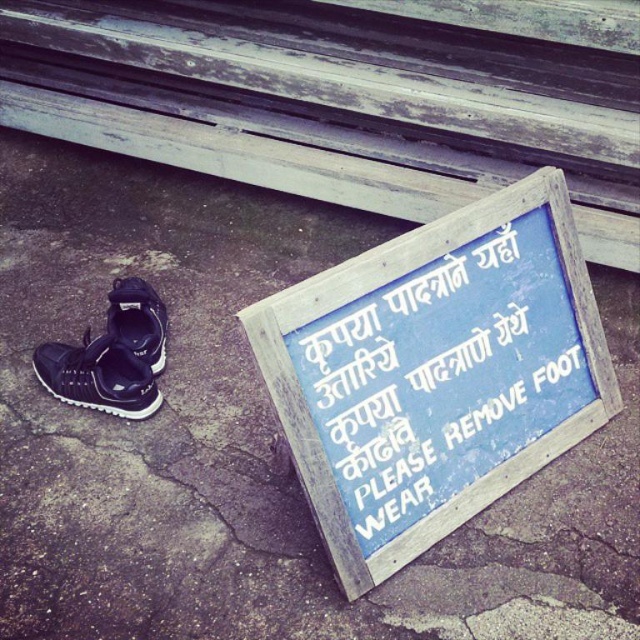
Question: Is blue wooden sign at lower center positioned at the back of black matte shoe at left?

Choices:
 (A) yes
 (B) no

Answer: (B)

Question: Which of the following is the farthest from the observer?

Choices:
 (A) black matte shoe at left
 (B) blue wooden sign at lower center

Answer: (A)

Question: Which point is closer to the camera taking this photo?

Choices:
 (A) (579, 150)
 (B) (49, 365)

Answer: (B)

Question: Which object appears farthest from the camera in this image?

Choices:
 (A) blue wooden sign at lower center
 (B) black matte shoe at left

Answer: (B)

Question: Is blue wooden sign at lower center behind black matte sneaker at lower left?

Choices:
 (A) no
 (B) yes

Answer: (A)

Question: In this image, where is black matte sneaker at lower left located relative to black matte shoe at left?

Choices:
 (A) right
 (B) left

Answer: (B)